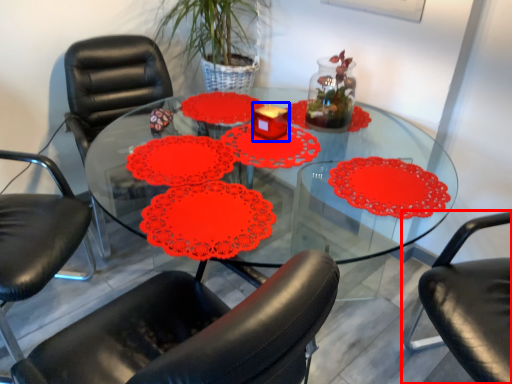
Question: Which object is further to the camera taking this photo, chair (highlighted by a red box) or candle holder (highlighted by a blue box)?

Choices:
 (A) chair
 (B) candle holder

Answer: (B)